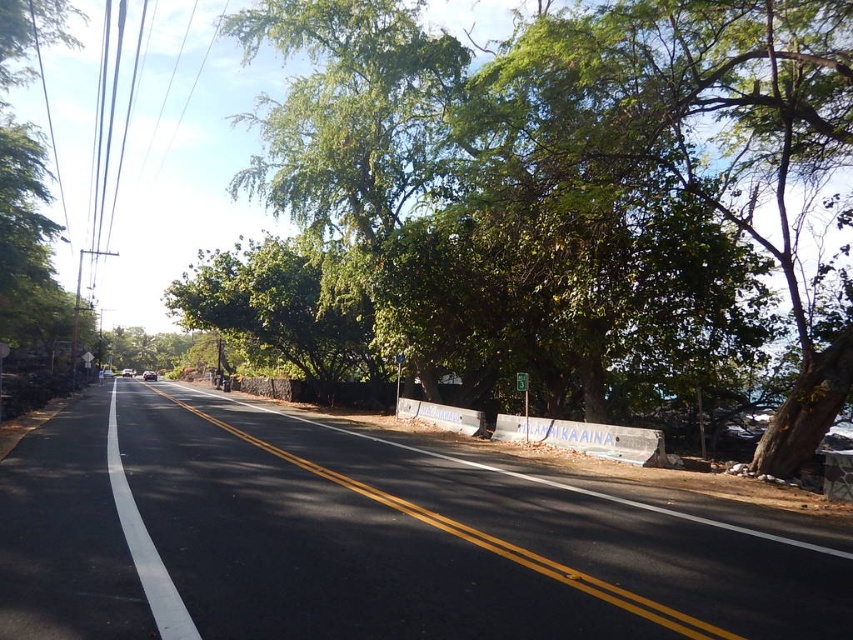
Question: Which of the following is the farthest from the observer?

Choices:
 (A) (160, 637)
 (B) (604, 600)
 (C) (465, 266)

Answer: (C)

Question: Is green leafy tree at center below white asphalt road at center?

Choices:
 (A) no
 (B) yes

Answer: (A)

Question: Is green leafy tree at center to the right of white asphalt road at center from the viewer's perspective?

Choices:
 (A) yes
 (B) no

Answer: (A)

Question: Among these points, which one is farthest from the camera?

Choices:
 (A) (143, 566)
 (B) (641, 259)
 (C) (442, 528)

Answer: (B)

Question: Among these objects, which one is nearest to the camera?

Choices:
 (A) white asphalt road at center
 (B) green leafy tree at center

Answer: (A)

Question: Can you confirm if green leafy tree at center is bigger than black asphalt road at center?

Choices:
 (A) no
 (B) yes

Answer: (B)